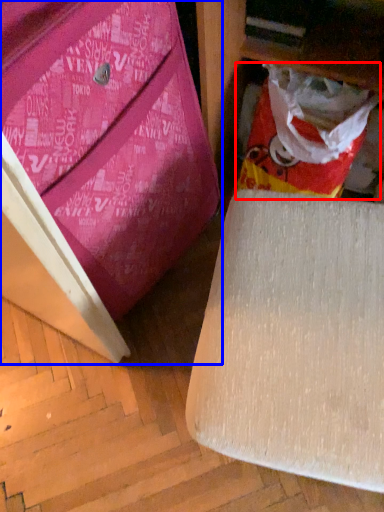
Question: Which of the following is the closest to the observer, shopping bag (highlighted by a red box) or furniture (highlighted by a blue box)?

Choices:
 (A) shopping bag
 (B) furniture

Answer: (B)